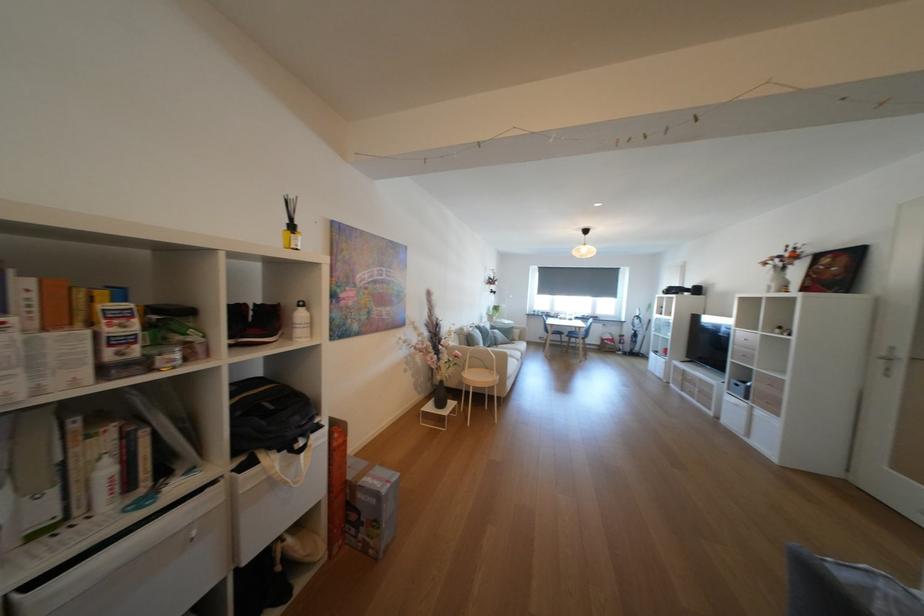
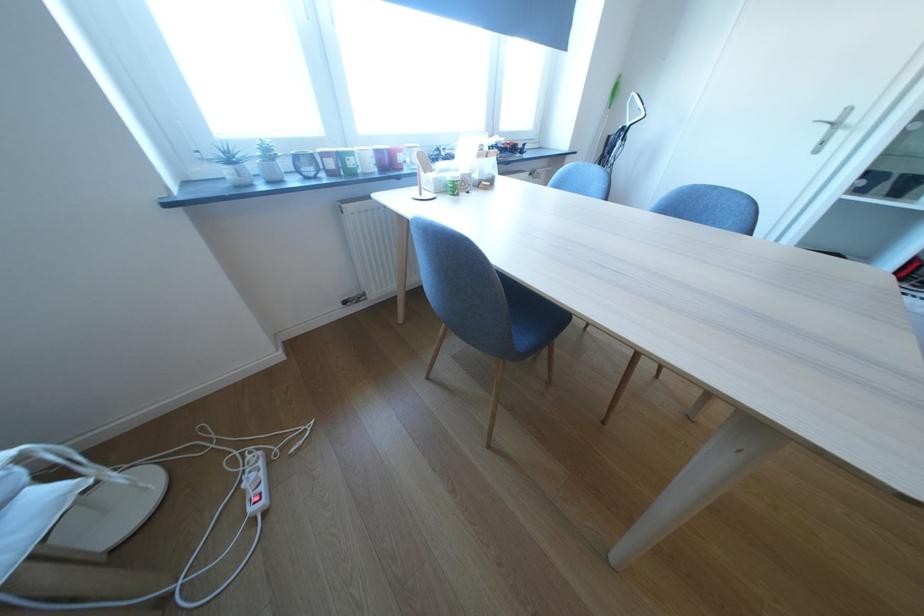
The point at (561, 315) is marked in the first image. Where is the corresponding point in the second image?

(361, 164)